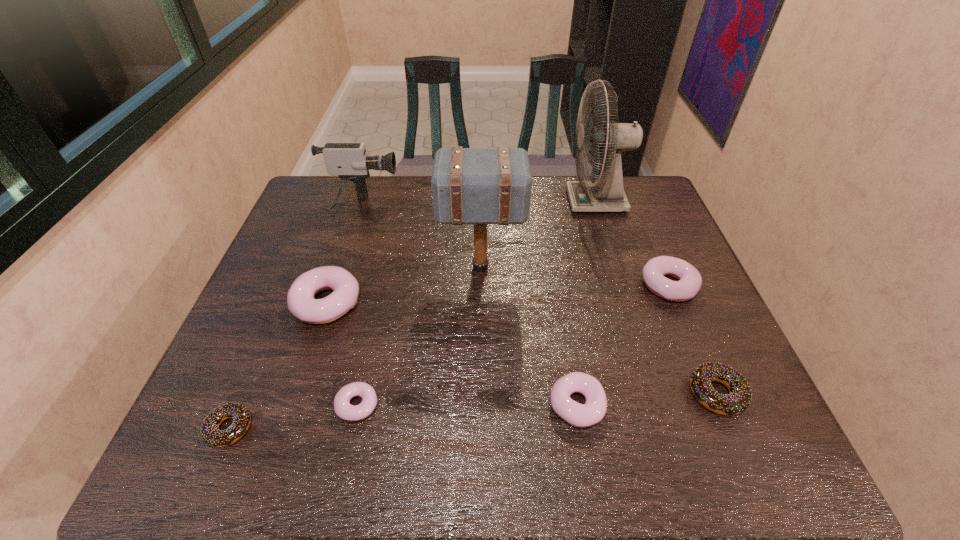
This screenshot has height=540, width=960. I want to click on gray fan, so click(607, 194).

Find the location of a particular element. mallet is located at coordinates (480, 186).

Find the location of `the fifth object from left to right`. the fifth object from left to right is located at coordinates (480, 186).

You are a GUI agent. You are given a task and a screenshot of the screen. Output one action in this format:
    pyautogui.click(x=<x>, y=<y>)
    Task: Click on the white camcorder
    The width and height of the screenshot is (960, 540).
    Given the screenshot: What is the action you would take?
    pyautogui.click(x=349, y=161)

Locate an element on the screen. The image size is (960, 540). the seventh shortest object is located at coordinates (349, 161).

Where is `the leftmost purple doughnut`? the leftmost purple doughnut is located at coordinates [x=301, y=302].

This screenshot has width=960, height=540. I want to click on the biggest purple doughnut, so click(x=301, y=302).

At what (x,y) coordinates should I click in order to perform the action: click on the fifth shortest doughnut. Please return your answer as a coordinate pair (x, y). Looking at the image, I should click on (690, 281).

Identify the location of the fifth tallest object. (690, 281).

In order to click on the second smallest purple doughnut in this screenshot , I will do `click(576, 414)`.